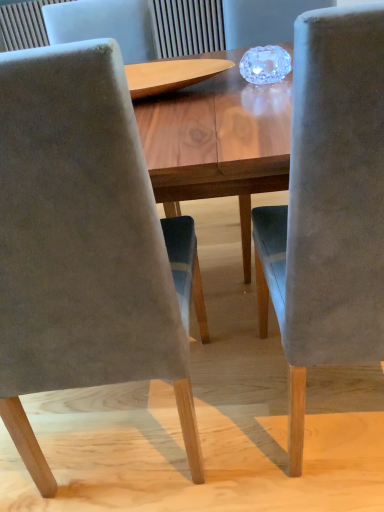
Question: Does velvet gray chair at center, the 1th chair positioned from the left, have a greater width compared to velvet gray chair at right, which ranks as the first chair in right-to-left order?

Choices:
 (A) no
 (B) yes

Answer: (B)

Question: Can you confirm if velvet gray chair at center, the 1th chair positioned from the left, is bigger than velvet gray chair at right, the second chair in the left-to-right sequence?

Choices:
 (A) no
 (B) yes

Answer: (B)

Question: Is velvet gray chair at center, which ranks as the second chair in right-to-left order, aimed at velvet gray chair at right, the second chair in the left-to-right sequence?

Choices:
 (A) yes
 (B) no

Answer: (B)

Question: From a real-world perspective, does velvet gray chair at center, the 1th chair positioned from the left, stand above velvet gray chair at right, which ranks as the first chair in right-to-left order?

Choices:
 (A) yes
 (B) no

Answer: (A)

Question: Is velvet gray chair at center, which ranks as the second chair in right-to-left order, shorter than velvet gray chair at right, which ranks as the first chair in right-to-left order?

Choices:
 (A) yes
 (B) no

Answer: (B)

Question: Does velvet gray chair at center, the 1th chair positioned from the left, have a greater height compared to velvet gray chair at right, the second chair in the left-to-right sequence?

Choices:
 (A) no
 (B) yes

Answer: (B)

Question: Is velvet gray chair at right, the second chair in the left-to-right sequence, at the right side of velvet gray chair at center, the 1th chair positioned from the left?

Choices:
 (A) no
 (B) yes

Answer: (B)

Question: Considering the relative sizes of velvet gray chair at right, the second chair in the left-to-right sequence, and velvet gray chair at center, the 1th chair positioned from the left, in the image provided, is velvet gray chair at right, the second chair in the left-to-right sequence, bigger than velvet gray chair at center, the 1th chair positioned from the left,?

Choices:
 (A) no
 (B) yes

Answer: (A)

Question: Is velvet gray chair at right, which ranks as the first chair in right-to-left order, placed right next to velvet gray chair at center, which ranks as the second chair in right-to-left order?

Choices:
 (A) yes
 (B) no

Answer: (B)

Question: Would you say velvet gray chair at center, which ranks as the second chair in right-to-left order, is part of velvet gray chair at right, the second chair in the left-to-right sequence,'s contents?

Choices:
 (A) no
 (B) yes

Answer: (A)

Question: Is velvet gray chair at right, the second chair in the left-to-right sequence, outside velvet gray chair at center, the 1th chair positioned from the left?

Choices:
 (A) yes
 (B) no

Answer: (A)

Question: From a real-world perspective, is velvet gray chair at right, which ranks as the first chair in right-to-left order, under velvet gray chair at center, the 1th chair positioned from the left?

Choices:
 (A) yes
 (B) no

Answer: (A)

Question: Is point (289, 449) closer or farther from the camera than point (31, 441)?

Choices:
 (A) farther
 (B) closer

Answer: (A)